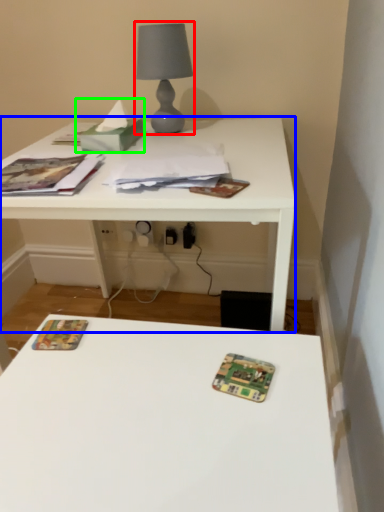
Question: Considering the real-world distances, which object is farthest from table lamp (highlighted by a red box)? table (highlighted by a blue box) or tissue (highlighted by a green box)?

Choices:
 (A) table
 (B) tissue

Answer: (A)